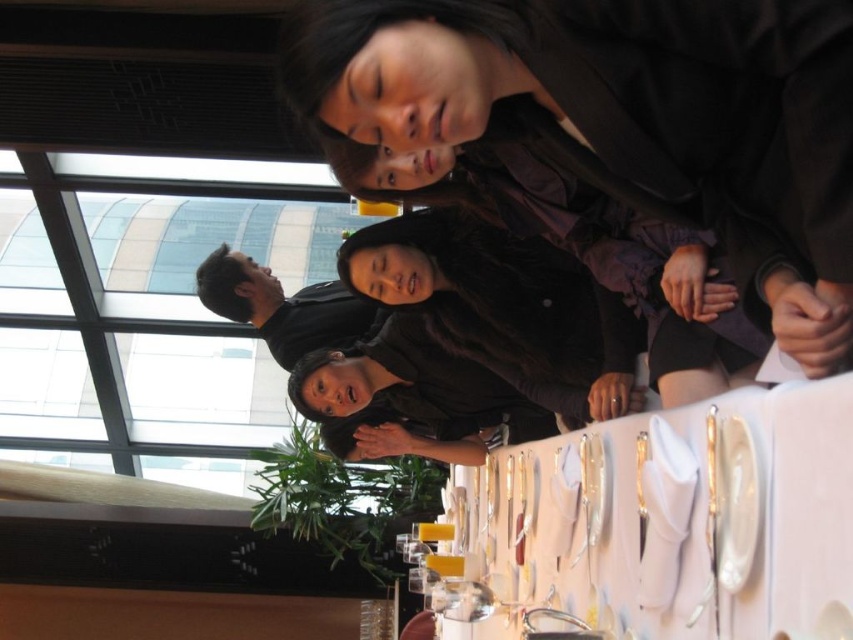
You are a photographer at the event and want to capture a candid shot of the dark brown leather jacket at upper center. Since you can only focus on objects within a 0.15 unit radius from your current position at point (x=625, y=118), will the jacket be in focus?

The point (x=625, y=118) is where the dark brown leather jacket at upper center is located. Since the focus radius is 0.15 units, the jacket will be in focus as it is exactly at the center of the focus area.

You are a photographer trying to capture a candid shot of the dark brown leather jacket at upper center without including the white cloth at center in the frame. Based on their positions, can you position yourself in a way to achieve this?

The dark brown leather jacket at upper center is located above the white cloth at center. By positioning the camera slightly lower, you can frame the shot to focus on the jacket while excluding the white cloth below it.

You are standing at the entrance of the room and want to approach the dark brown leather jacket at upper center. Based on its coordinates, is it positioned closer to the left or right side of the table?

The dark brown leather jacket at upper center is located at point 0.186 on the x and 0.734 on the y. Since the x coordinate is less than 0.5, it is closer to the left side of the table.